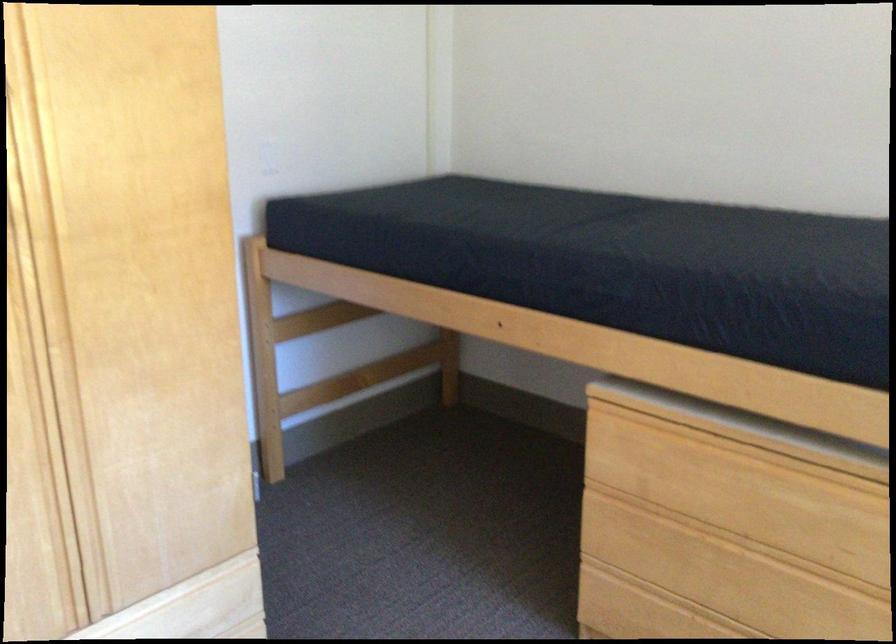
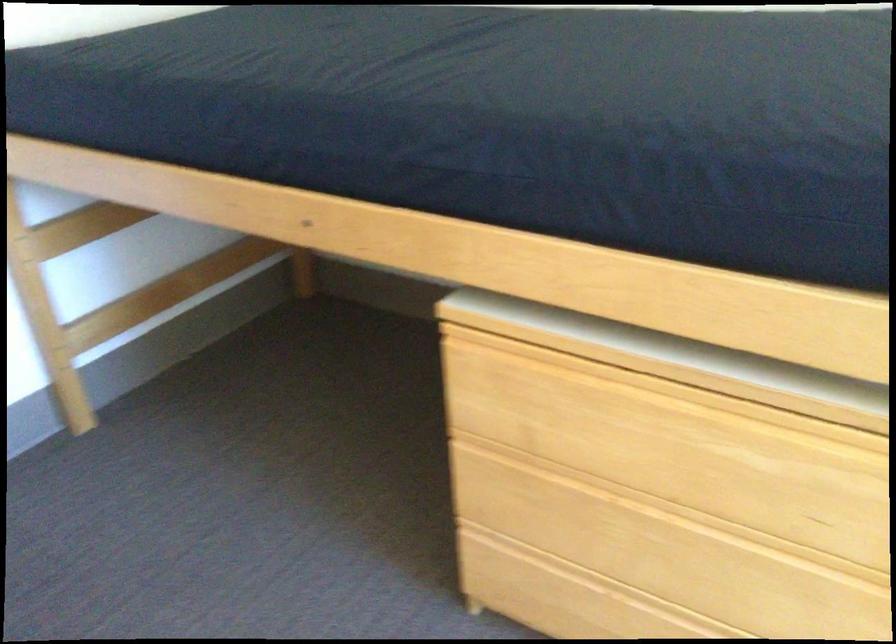
What movement of the cameraman would produce the second image?

The cameraman walked toward right, forward.